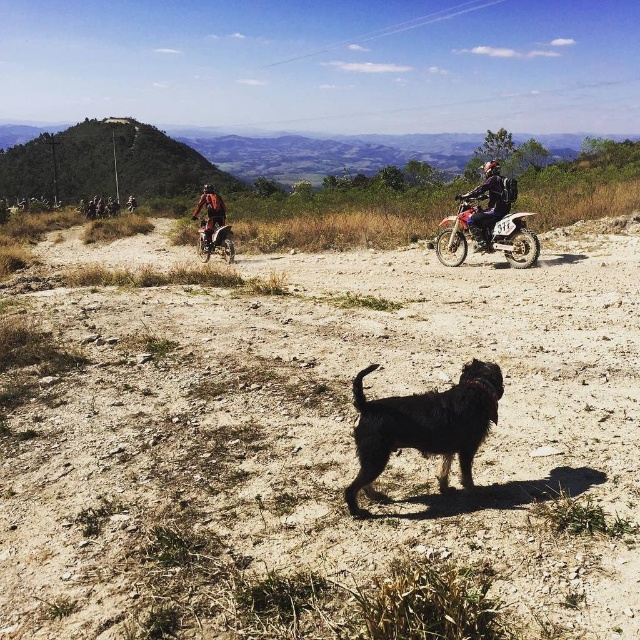
Question: Can you confirm if wet fur dog at center is thinner than orange fabric jacket at upper left?

Choices:
 (A) yes
 (B) no

Answer: (B)

Question: Estimate the real-world distances between objects in this image. Which object is farther from the orange matte dirt bike at right?

Choices:
 (A) green grassy hill at upper left
 (B) orange fabric jacket at upper left

Answer: (A)

Question: Which object appears closest to the camera in this image?

Choices:
 (A) matte black motorcycle at center
 (B) orange matte dirt bike at right

Answer: (B)

Question: Considering the relative positions of green grassy hill at upper left and orange matte dirt bike at right in the image provided, where is green grassy hill at upper left located with respect to orange matte dirt bike at right?

Choices:
 (A) left
 (B) right

Answer: (A)

Question: Which point is closer to the camera?

Choices:
 (A) (221, 221)
 (B) (60, 552)
 (C) (486, 244)
 (D) (480, 403)

Answer: (D)

Question: Is metallic silver dirt bike at center-left above orange fabric jacket at upper left?

Choices:
 (A) yes
 (B) no

Answer: (B)